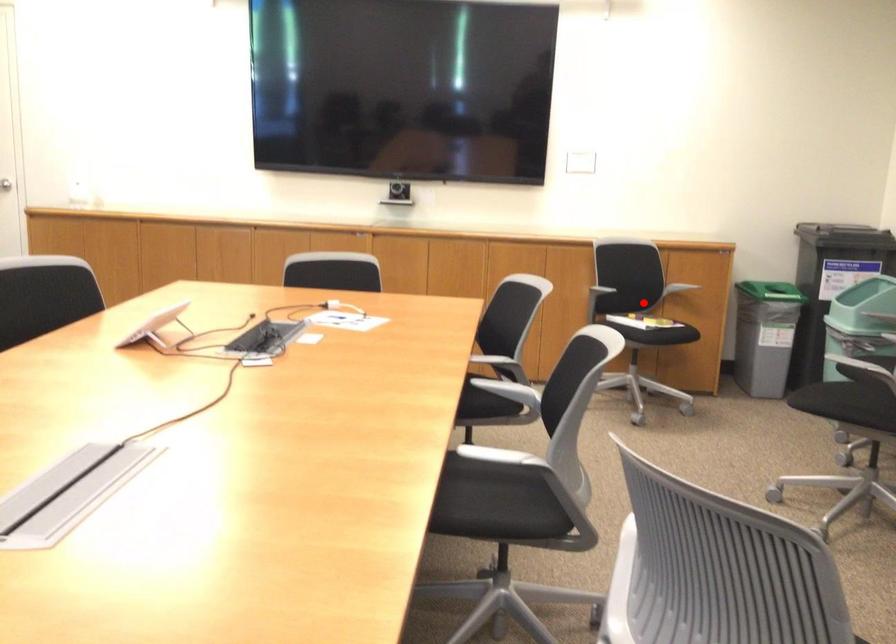
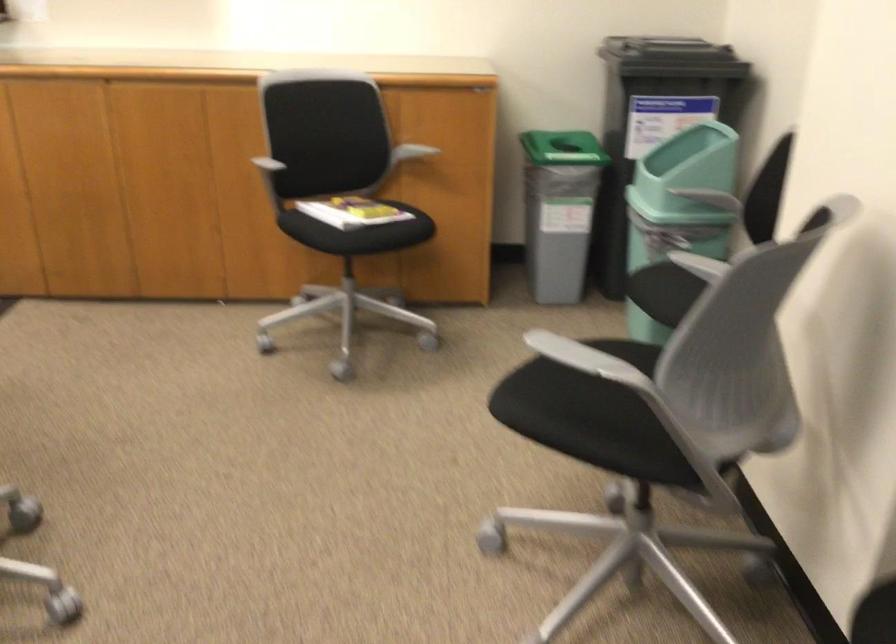
Question: I am providing you with two images of the same scene from different viewpoints. In image1, a red point is highlighted. Considering the same 3D point in image2, which of the following is correct?

Choices:
 (A) It is closer
 (B) It is farther

Answer: (A)